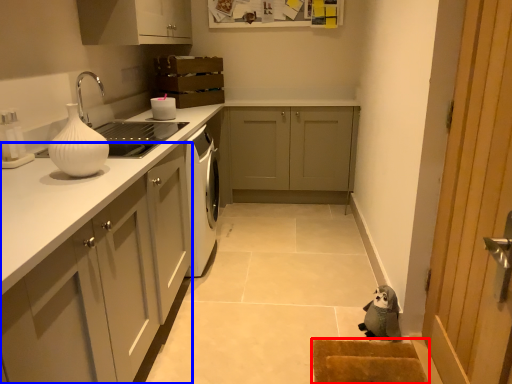
Question: Which object appears farthest to the camera in this image, doormat (highlighted by a red box) or cabinetry (highlighted by a blue box)?

Choices:
 (A) doormat
 (B) cabinetry

Answer: (A)